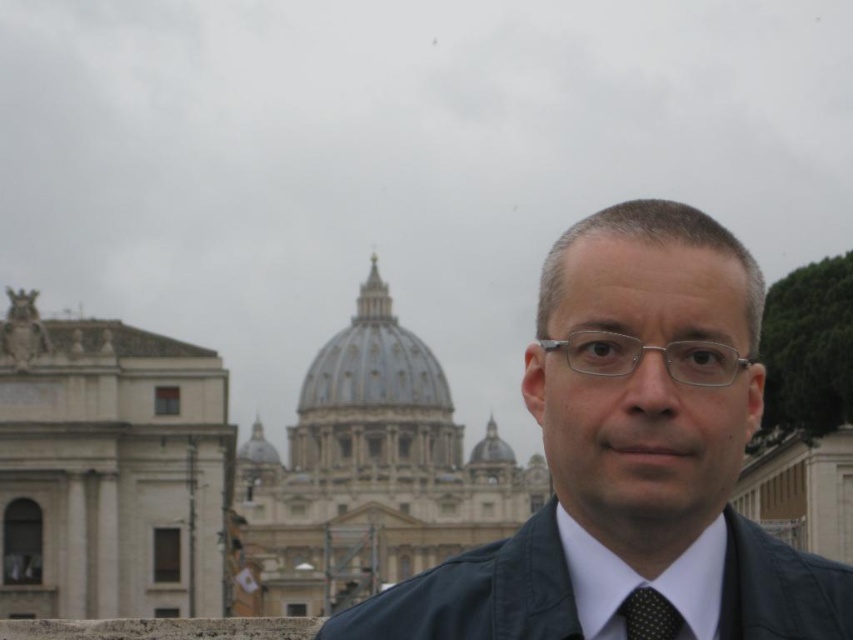
Question: Is matte black jacket at center closer to the viewer compared to white smooth dress shirt at center?

Choices:
 (A) yes
 (B) no

Answer: (A)

Question: Which object appears closest to the camera in this image?

Choices:
 (A) black dotted fabric tie at center
 (B) white smooth dress shirt at center

Answer: (A)

Question: Which object appears farthest from the camera in this image?

Choices:
 (A) black dotted fabric tie at center
 (B) black leather jacket at center
 (C) matte black jacket at center

Answer: (A)

Question: Is black leather jacket at center bigger than white smooth dress shirt at center?

Choices:
 (A) yes
 (B) no

Answer: (A)

Question: Which object is the closest to the matte black jacket at center?

Choices:
 (A) black dotted fabric tie at center
 (B) white smooth dress shirt at center
 (C) black leather jacket at center

Answer: (B)

Question: Can you confirm if matte black jacket at center is wider than white smooth dress shirt at center?

Choices:
 (A) yes
 (B) no

Answer: (A)